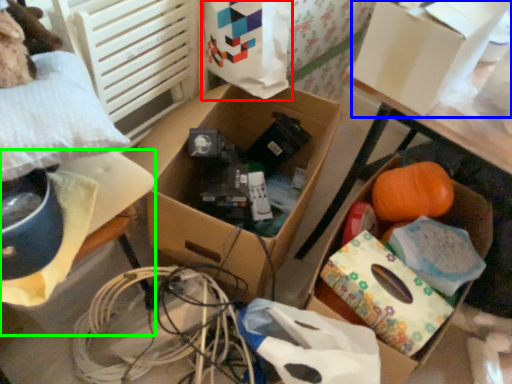
Question: Based on their relative distances, which object is farther from shopping bag (highlighted by a red box)? Choose from storage box (highlighted by a blue box) and storage box (highlighted by a green box).

Choices:
 (A) storage box
 (B) storage box

Answer: (B)